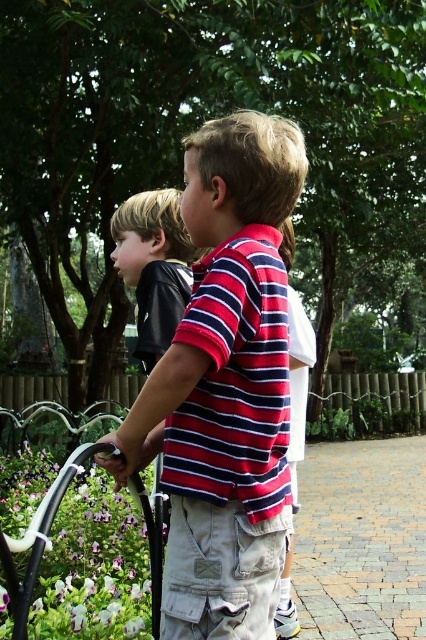
You are a photographer trying to capture a photo of the striped cotton shirt at center and the white plastic rail at lower left. Since you want both objects to be clearly visible in the frame, which object should you focus on first to ensure proper focus, considering their relative sizes?

The striped cotton shirt at center has a greater height compared to the white plastic rail at lower left, so you should focus on the striped cotton shirt at center first because it is larger and requires more precise focus to capture details clearly.

You are a photographer trying to capture a photo of the striped cotton shirt at center and the white plastic rail at lower left. Which object should you focus on first to ensure both are in sharp focus?

The striped cotton shirt at center is closer to you than the white plastic rail at lower left, so you should focus on the striped cotton shirt at center first to ensure both are in sharp focus.